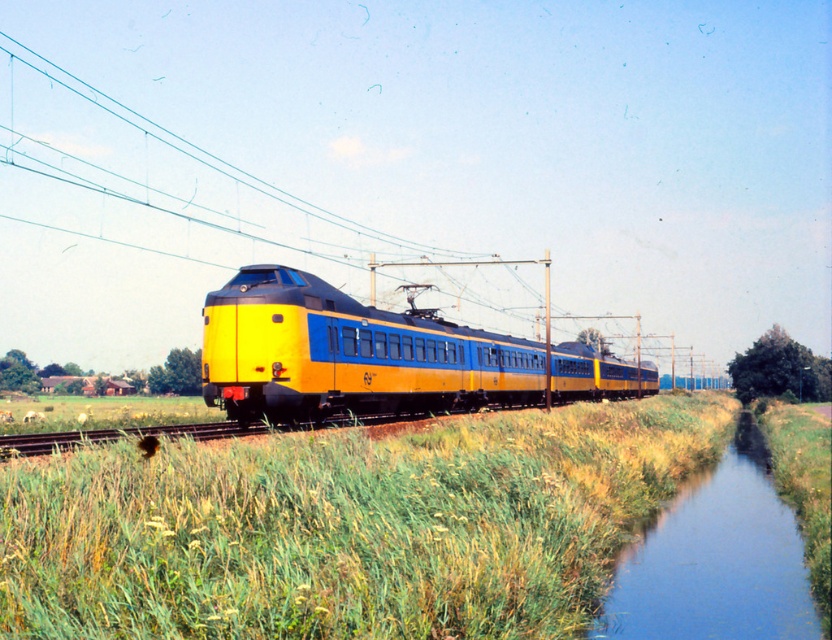
You are a passenger on the yellow matte train at center and want to look out the window to see the green grassy area at center. Based on the scene, can you see the top of the green grassy at center from your seat?

The green grassy at center is not as tall as yellow matte train at center, so yes, you can see the top of the green grassy at center from your seat on the train.

You are standing at point A, which is located at coordinates (345, 525). You want to walk towards the train. Is the path from your current position to the train clear of any obstacles?

The path from point A to the train is clear of obstacles because the area at point A is green grassy at center, which indicates no obstructions.